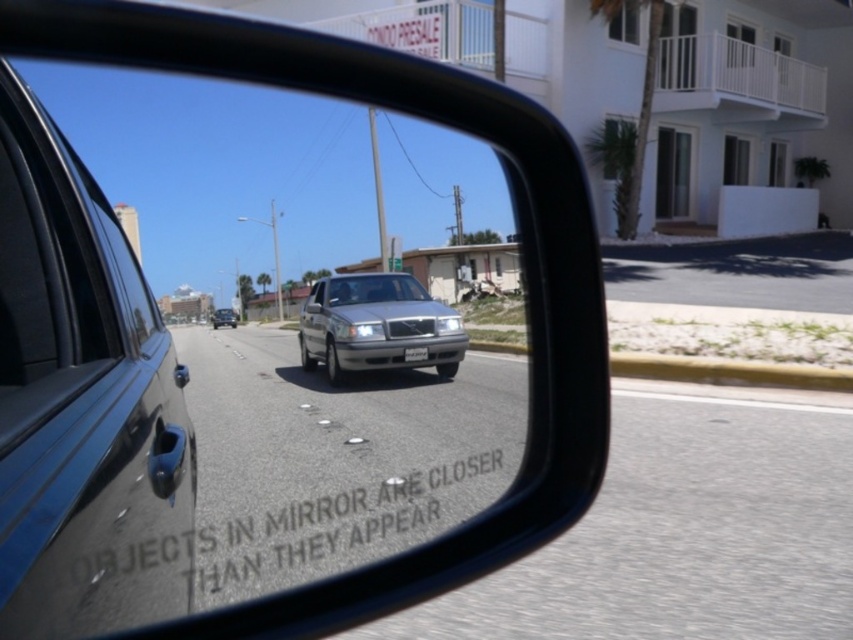
Which is more to the right, black plastic mirror at center or satin silver sedan at center?

black plastic mirror at center is more to the right.

Can you confirm if black plastic mirror at center is positioned to the right of satin silver sedan at center?

Yes, black plastic mirror at center is to the right of satin silver sedan at center.

The image size is (853, 640). What do you see at coordinates (524, 262) in the screenshot?
I see `black plastic mirror at center` at bounding box center [524, 262].

Locate an element on the screen. black plastic mirror at center is located at coordinates (524, 262).

Is point (283, 36) closer to viewer compared to point (219, 323)?

Yes, point (283, 36) is closer to viewer.

Is black plastic mirror at center below silver metallic sedan at center?

No.

Which is behind, point (582, 371) or point (219, 317)?

The point (219, 317) is more distant.

Locate an element on the screen. black plastic mirror at center is located at coordinates (524, 262).

Is satin silver sedan at center thinner than silver metallic sedan at center?

Indeed, satin silver sedan at center has a lesser width compared to silver metallic sedan at center.

What do you see at coordinates (376, 326) in the screenshot? The width and height of the screenshot is (853, 640). I see `satin silver sedan at center` at bounding box center [376, 326].

The width and height of the screenshot is (853, 640). What do you see at coordinates (376, 326) in the screenshot? I see `satin silver sedan at center` at bounding box center [376, 326].

The image size is (853, 640). I want to click on satin silver sedan at center, so [x=376, y=326].